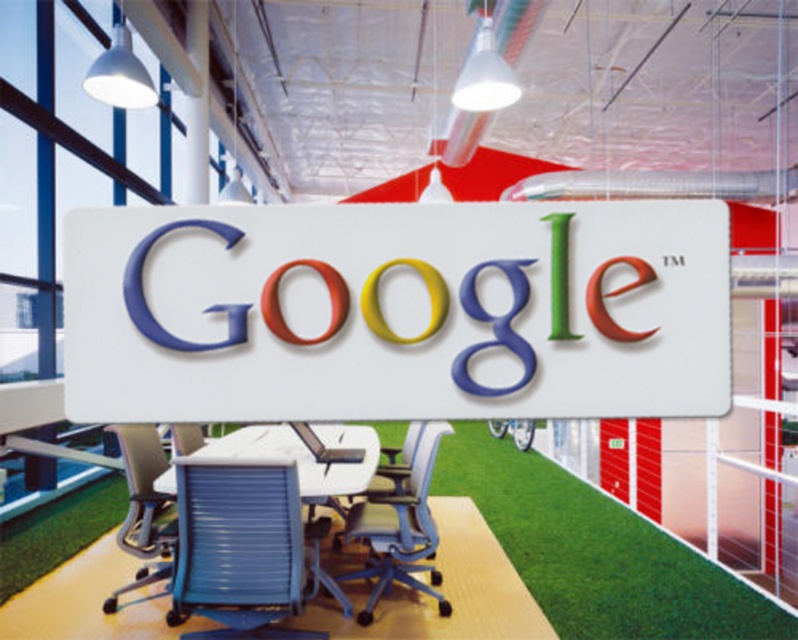
Can you confirm if matte blue office chair at center is bigger than blue mesh office chair at lower left?

Yes.

Does matte blue office chair at center lie in front of blue mesh office chair at lower left?

No, it is behind blue mesh office chair at lower left.

Does point (421, 582) lie behind point (137, 513)?

Yes, it is behind point (137, 513).

Where is `matte blue office chair at center`? matte blue office chair at center is located at coordinates (399, 531).

Which is more to the left, white glossy sign at center or blue mesh swivel chair at lower left?

Positioned to the left is blue mesh swivel chair at lower left.

How much distance is there between white glossy sign at center and blue mesh swivel chair at lower left?

The distance of white glossy sign at center from blue mesh swivel chair at lower left is 2.24 meters.

You are a GUI agent. You are given a task and a screenshot of the screen. Output one action in this format:
    pyautogui.click(x=<x>, y=<y>)
    Task: Click on the white glossy sign at center
    The width and height of the screenshot is (798, 640).
    Given the screenshot: What is the action you would take?
    397,310

Which is below, blue mesh swivel chair at lower left or blue mesh office chair at lower left?

blue mesh swivel chair at lower left

From the picture: Measure the distance between point (198, 472) and camera.

A distance of 2.69 meters exists between point (198, 472) and camera.

Where is `blue mesh swivel chair at lower left`? blue mesh swivel chair at lower left is located at coordinates (238, 548).